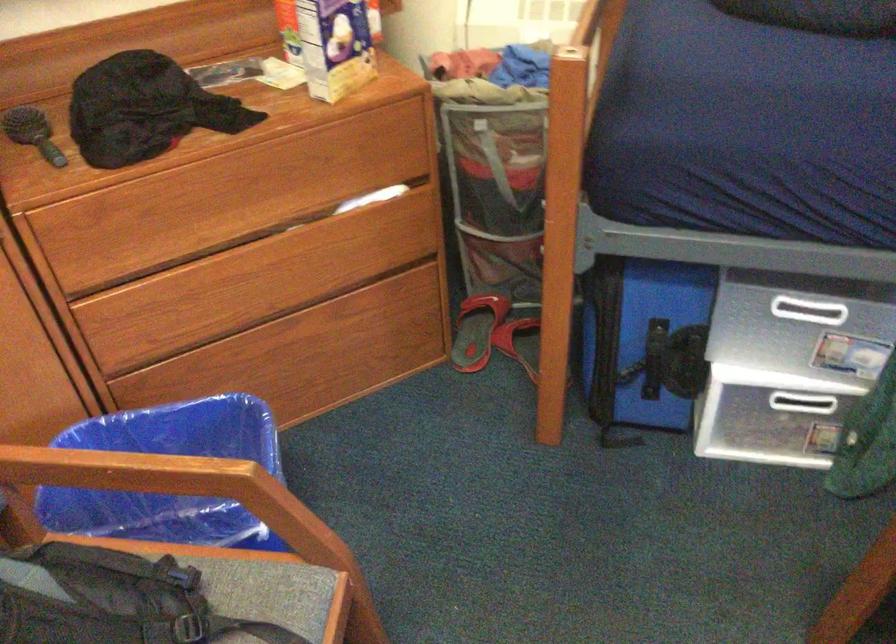
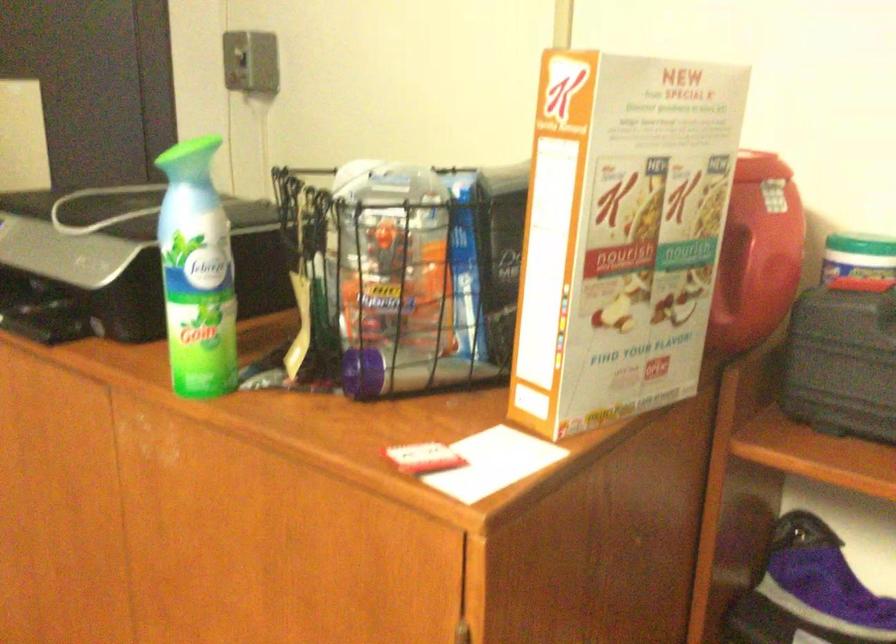
Question: How did the camera likely rotate?

Choices:
 (A) Left
 (B) Right
 (C) Up
 (D) Down

Answer: (A)